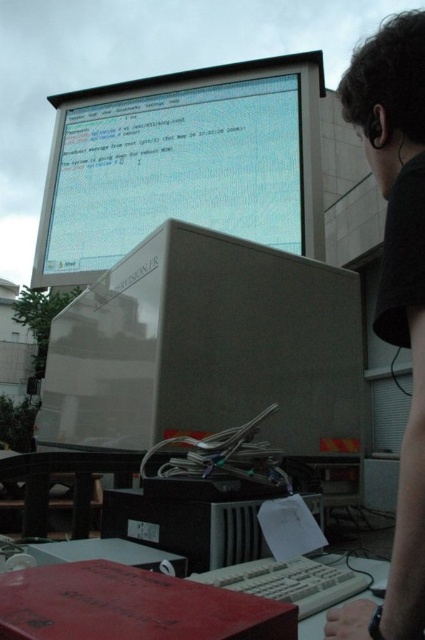
You are a technician who needs to access the keyboard and mouse located near the beige computer tower. However, there is a matte gray monitor at upper center and a black matte shirt at upper right in your way. Which object must you move to reach the keyboard and mouse?

You must move the matte gray monitor at upper center because it is positioned over the black matte shirt at upper right, blocking access to the keyboard and mouse near the beige computer tower.

You are a technician who needs to access the keyboard and mouse in front of the beige computer tower. However, there is a satin white monitor at center and a black matte shirt at upper right in your way. Which object should you move first to reach the keyboard and mouse?

The black matte shirt at upper right is behind the satin white monitor at center, so you should move the satin white monitor at center first to access the keyboard and mouse.

You are standing in front of a setup with a beige computer tower and a monitor. The monitor is at point (x=183, y=163). If you want to reach the monitor from the tower, in which direction should you move?

The matte gray monitor at upper center is located at point (x=183, y=163), so to reach it from the beige computer tower, you should move towards the upper center direction.